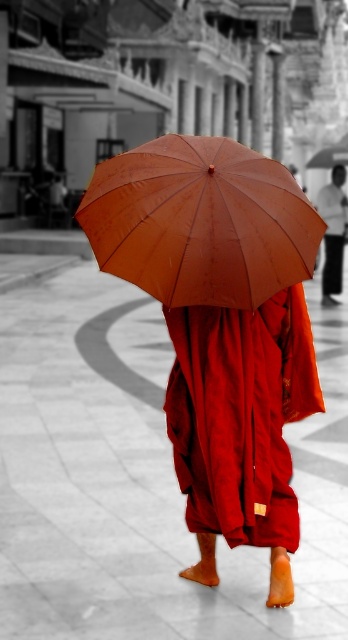
Question: Can you confirm if brown matte umbrella at center is positioned to the right of smooth skin head at upper center?

Choices:
 (A) no
 (B) yes

Answer: (A)

Question: Which point is closer to the camera?

Choices:
 (A) (333, 211)
 (B) (311, 476)

Answer: (B)

Question: Observing the image, what is the correct spatial positioning of matte orange umbrella at center in reference to smooth skin head at upper center?

Choices:
 (A) above
 (B) below

Answer: (B)

Question: Which of the following is the closest to the observer?

Choices:
 (A) (339, 224)
 (B) (69, 536)

Answer: (B)

Question: Which of these objects is positioned closest to the smooth skin head at upper center?

Choices:
 (A) matte orange umbrella at center
 (B) matte red robe at center
 (C) brown matte umbrella at center
 (D) white tile pavement at center

Answer: (A)

Question: Does matte red robe at center appear under matte orange umbrella at center?

Choices:
 (A) yes
 (B) no

Answer: (A)